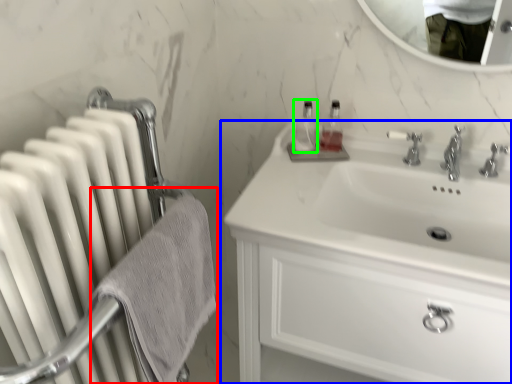
Question: Based on their relative distances, which object is nearer to bath towel (highlighted by a red box)? Choose from bathroom cabinet (highlighted by a blue box) and bottle (highlighted by a green box).

Choices:
 (A) bathroom cabinet
 (B) bottle

Answer: (A)